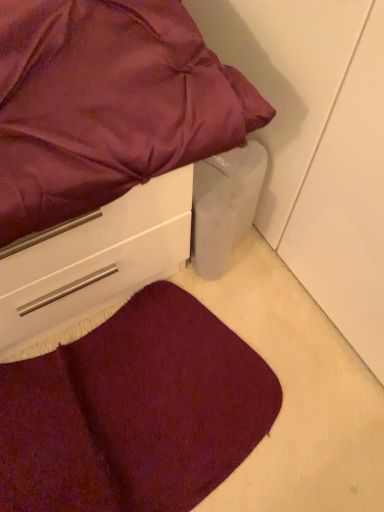
Question: Is satin purple bed at upper left surrounding burgundy carpet at lower left?

Choices:
 (A) no
 (B) yes

Answer: (A)

Question: Is satin purple bed at upper left oriented away from burgundy carpet at lower left?

Choices:
 (A) no
 (B) yes

Answer: (A)

Question: Considering the relative sizes of satin purple bed at upper left and burgundy carpet at lower left in the image provided, is satin purple bed at upper left bigger than burgundy carpet at lower left?

Choices:
 (A) yes
 (B) no

Answer: (A)

Question: Could you tell me if satin purple bed at upper left is turned towards burgundy carpet at lower left?

Choices:
 (A) yes
 (B) no

Answer: (B)

Question: Considering the relative sizes of satin purple bed at upper left and burgundy carpet at lower left in the image provided, is satin purple bed at upper left wider than burgundy carpet at lower left?

Choices:
 (A) no
 (B) yes

Answer: (A)

Question: Does satin purple bed at upper left have a greater height compared to burgundy carpet at lower left?

Choices:
 (A) no
 (B) yes

Answer: (B)

Question: Can you confirm if burgundy carpet at lower left is wider than satin purple bed at upper left?

Choices:
 (A) no
 (B) yes

Answer: (B)

Question: Does burgundy carpet at lower left have a lesser width compared to satin purple bed at upper left?

Choices:
 (A) no
 (B) yes

Answer: (A)

Question: Does burgundy carpet at lower left have a lesser height compared to satin purple bed at upper left?

Choices:
 (A) no
 (B) yes

Answer: (B)

Question: Considering the relative positions of burgundy carpet at lower left and satin purple bed at upper left in the image provided, is burgundy carpet at lower left to the left of satin purple bed at upper left from the viewer's perspective?

Choices:
 (A) yes
 (B) no

Answer: (B)

Question: Is satin purple bed at upper left a part of burgundy carpet at lower left?

Choices:
 (A) yes
 (B) no

Answer: (B)

Question: From a real-world perspective, is burgundy carpet at lower left over satin purple bed at upper left?

Choices:
 (A) yes
 (B) no

Answer: (B)

Question: Does point (142, 361) appear closer or farther from the camera than point (59, 0)?

Choices:
 (A) closer
 (B) farther

Answer: (B)